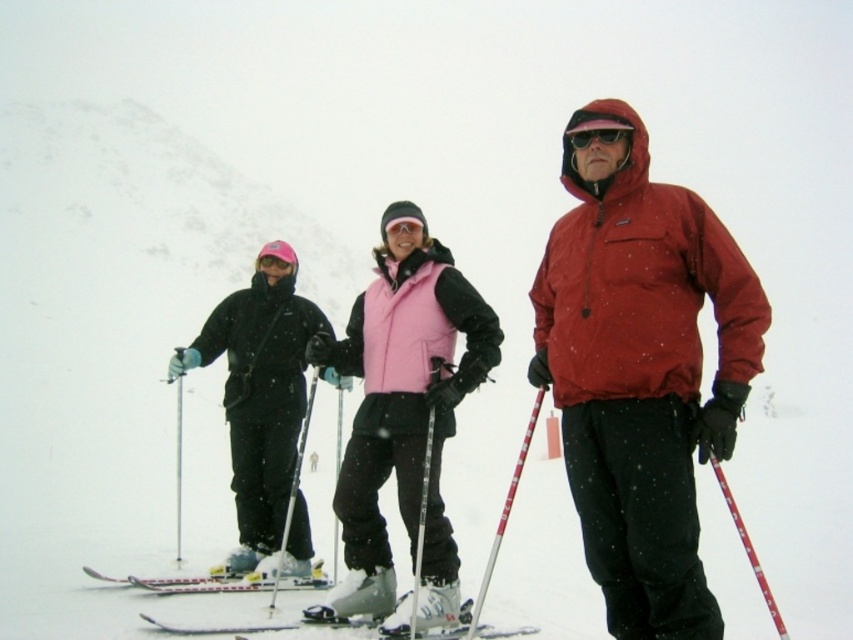
Can you confirm if matte black ski jacket at center is positioned to the left of matte red jacket at center?

Indeed, matte black ski jacket at center is positioned on the left side of matte red jacket at center.

Between point (689, 340) and point (695, 202), which one is positioned in front?

Point (689, 340) is more forward.

What do you see at coordinates (641, 372) in the screenshot?
I see `matte black ski jacket at center` at bounding box center [641, 372].

Where is `matte black ski jacket at center`? matte black ski jacket at center is located at coordinates (641, 372).

Can you confirm if matte red jacket at center is positioned to the left of pink fleece vest at center?

In fact, matte red jacket at center is to the right of pink fleece vest at center.

What do you see at coordinates (641, 372) in the screenshot? This screenshot has height=640, width=853. I see `matte red jacket at center` at bounding box center [641, 372].

Is point (616, 611) closer to viewer compared to point (368, 515)?

That is True.

Locate an element on the screen. This screenshot has width=853, height=640. matte red jacket at center is located at coordinates (641, 372).

Which is in front, point (250, 627) or point (601, 134)?

Point (601, 134)

What do you see at coordinates (213, 628) in the screenshot?
I see `white plastic ski at center` at bounding box center [213, 628].

Identify the location of white plastic ski at center. (213, 628).